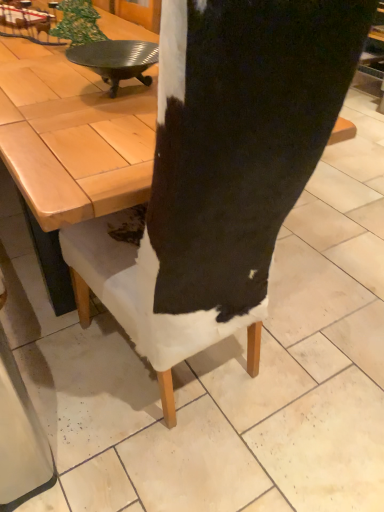
Question: Should I look upward or downward to see wooden at center?

Choices:
 (A) down
 (B) up

Answer: (B)

Question: Can you confirm if metallic silver plate at upper left is positioned to the right of wooden at center?

Choices:
 (A) no
 (B) yes

Answer: (B)

Question: Does metallic silver plate at upper left touch wooden at center?

Choices:
 (A) yes
 (B) no

Answer: (B)

Question: Is metallic silver plate at upper left not near wooden at center?

Choices:
 (A) yes
 (B) no

Answer: (B)

Question: Is metallic silver plate at upper left to the left of wooden at center from the viewer's perspective?

Choices:
 (A) no
 (B) yes

Answer: (A)

Question: Considering the relative positions of metallic silver plate at upper left and wooden at center in the image provided, is metallic silver plate at upper left in front of wooden at center?

Choices:
 (A) yes
 (B) no

Answer: (B)

Question: Considering the relative sizes of metallic silver plate at upper left and wooden at center in the image provided, is metallic silver plate at upper left taller than wooden at center?

Choices:
 (A) yes
 (B) no

Answer: (B)

Question: From a real-world perspective, is wooden at center positioned under metallic silver plate at upper left based on gravity?

Choices:
 (A) no
 (B) yes

Answer: (B)

Question: Is wooden at center facing towards metallic silver plate at upper left?

Choices:
 (A) no
 (B) yes

Answer: (A)

Question: Is metallic silver plate at upper left a part of wooden at center?

Choices:
 (A) yes
 (B) no

Answer: (B)

Question: From the image's perspective, would you say wooden at center is shown under metallic silver plate at upper left?

Choices:
 (A) yes
 (B) no

Answer: (B)

Question: Does wooden at center have a greater width compared to metallic silver plate at upper left?

Choices:
 (A) yes
 (B) no

Answer: (A)

Question: From the image's perspective, is wooden at center over metallic silver plate at upper left?

Choices:
 (A) no
 (B) yes

Answer: (B)

Question: In the image, is metallic silver plate at upper left positioned in front of or behind wooden at center?

Choices:
 (A) behind
 (B) front

Answer: (A)